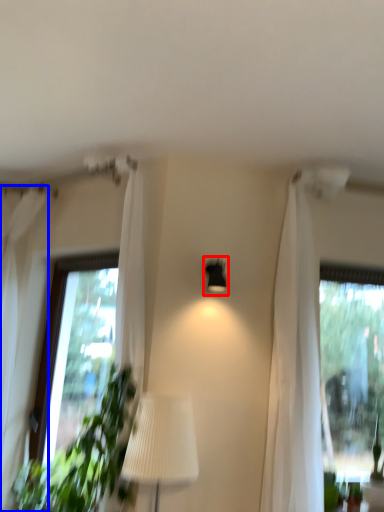
Question: Which object is closer to the camera taking this photo, lamp (highlighted by a red box) or curtain (highlighted by a blue box)?

Choices:
 (A) lamp
 (B) curtain

Answer: (B)